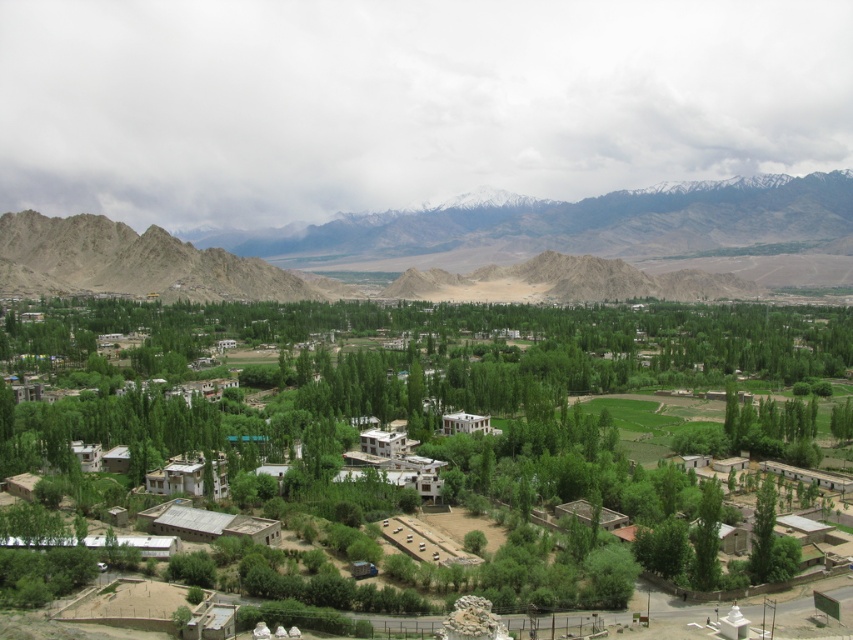
Does green leafy tree at center have a lesser height compared to rugged brown mountains at upper center?

Indeed, green leafy tree at center has a lesser height compared to rugged brown mountains at upper center.

Is point (78, 317) less distant than point (471, 224)?

Yes, it is in front of point (471, 224).

Where is `green leafy tree at center`? Image resolution: width=853 pixels, height=640 pixels. green leafy tree at center is located at coordinates (431, 394).